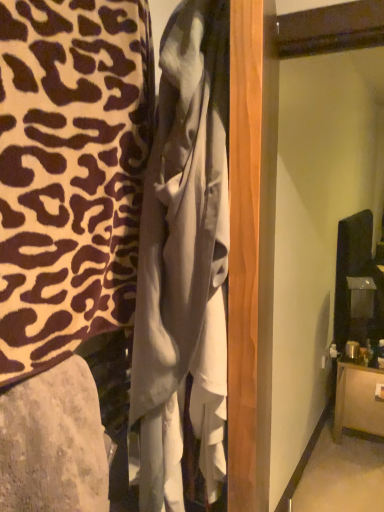
Question: From a real-world perspective, is white satin dress at center on top of matte gray fabric at lower left, the 2th furniture positioned from the top?

Choices:
 (A) yes
 (B) no

Answer: (A)

Question: From the image's perspective, does white satin dress at center appear higher than matte gray fabric at lower left, which is the 3th furniture from back to front?

Choices:
 (A) yes
 (B) no

Answer: (A)

Question: Is white satin dress at center oriented towards matte gray fabric at lower left, the second furniture in the left-to-right sequence?

Choices:
 (A) no
 (B) yes

Answer: (A)

Question: Is white satin dress at center positioned with its back to matte gray fabric at lower left, positioned as the second furniture in right-to-left order?

Choices:
 (A) yes
 (B) no

Answer: (B)

Question: Is white satin dress at center shorter than matte gray fabric at lower left, which is the 3th furniture from back to front?

Choices:
 (A) yes
 (B) no

Answer: (B)

Question: From the image's perspective, is matte gray fabric at lower left, positioned as the second furniture in bottom-to-top order, positioned above or below leopard print fabric at left, marked as the 3th furniture in a bottom-to-top arrangement?

Choices:
 (A) above
 (B) below

Answer: (B)

Question: Is matte gray fabric at lower left, which is the 3th furniture from back to front, spatially inside leopard print fabric at left, the 2th furniture in the back-to-front sequence, or outside of it?

Choices:
 (A) inside
 (B) outside

Answer: (B)

Question: Considering the positions of point (64, 432) and point (52, 11), is point (64, 432) closer or farther from the camera than point (52, 11)?

Choices:
 (A) closer
 (B) farther

Answer: (A)

Question: Is matte gray fabric at lower left, positioned as the second furniture in right-to-left order, taller or shorter than leopard print fabric at left, placed as the third furniture when sorted from right to left?

Choices:
 (A) tall
 (B) short

Answer: (B)

Question: From a real-world perspective, relative to leopard print fabric at left, marked as the 3th furniture in a bottom-to-top arrangement, is brown wood cabinet at lower right, which appears as the 3th furniture when viewed from the top, vertically above or below?

Choices:
 (A) above
 (B) below

Answer: (B)

Question: Choose the correct answer: Is brown wood cabinet at lower right, which is the third furniture in left-to-right order, inside leopard print fabric at left, placed as the third furniture when sorted from right to left, or outside it?

Choices:
 (A) outside
 (B) inside

Answer: (A)

Question: Considering the positions of brown wood cabinet at lower right, the 1th furniture when ordered from back to front, and leopard print fabric at left, placed as the third furniture when sorted from right to left, in the image, is brown wood cabinet at lower right, the 1th furniture when ordered from back to front, wider or thinner than leopard print fabric at left, placed as the third furniture when sorted from right to left,?

Choices:
 (A) wide
 (B) thin

Answer: (A)

Question: In terms of height, does brown wood cabinet at lower right, the 1th furniture positioned from the bottom, look taller or shorter compared to leopard print fabric at left, placed as the third furniture when sorted from right to left?

Choices:
 (A) short
 (B) tall

Answer: (A)

Question: Based on their positions, is brown wood cabinet at lower right, the 1th furniture positioned from the bottom, located to the left or right of matte gray fabric at lower left, positioned as the second furniture in right-to-left order?

Choices:
 (A) left
 (B) right

Answer: (B)

Question: Based on their sizes in the image, would you say brown wood cabinet at lower right, the 1th furniture positioned from the right, is bigger or smaller than matte gray fabric at lower left, which is the 1th furniture in front-to-back order?

Choices:
 (A) big
 (B) small

Answer: (A)